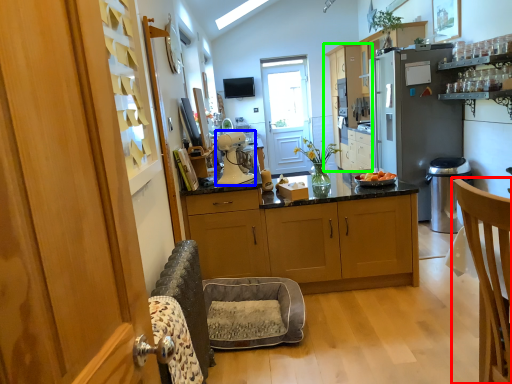
Question: Which is nearer to the chair (highlighted by a red box)? kitchen appliance (highlighted by a blue box) or cabinetry (highlighted by a green box).

Choices:
 (A) kitchen appliance
 (B) cabinetry

Answer: (A)